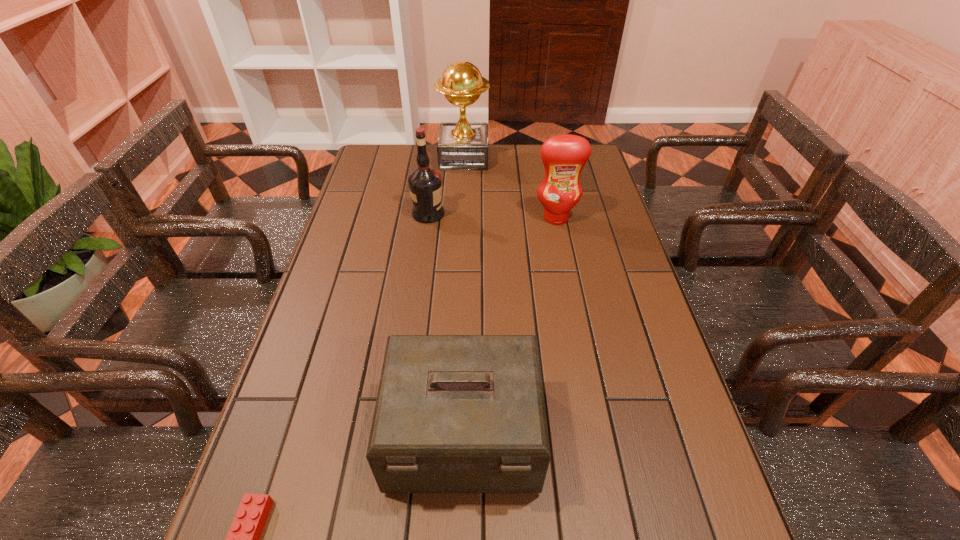
This screenshot has height=540, width=960. Identify the location of object at the right edge. (564, 156).

The image size is (960, 540). In the image, there is a desktop. In order to click on vacant space at the far edge in this screenshot , I will do pyautogui.click(x=431, y=145).

Locate an element on the screen. This screenshot has width=960, height=540. vacant space at the left edge of the desktop is located at coordinates (366, 264).

This screenshot has height=540, width=960. Find the location of `vacant area at the right edge`. vacant area at the right edge is located at coordinates pyautogui.click(x=589, y=231).

Where is `unoccupied area between the farthest object and the fourth tallest object`? unoccupied area between the farthest object and the fourth tallest object is located at coordinates (464, 296).

What are the coordinates of `vacant area that lies between the condiment and the farthest object` in the screenshot? It's located at (510, 188).

At what (x,y) coordinates should I click in order to perform the action: click on free space between the second shortest object and the rightmost object. Please return your answer as a coordinate pair (x, y). The height and width of the screenshot is (540, 960). Looking at the image, I should click on (510, 327).

What are the coordinates of `free space that is in between the tallest object and the rightmost object` in the screenshot? It's located at (510, 188).

Locate an element on the screen. empty location between the liquor and the first-aid kit is located at coordinates [445, 325].

Locate an element on the screen. empty space that is in between the tallest object and the fourth tallest object is located at coordinates (464, 296).